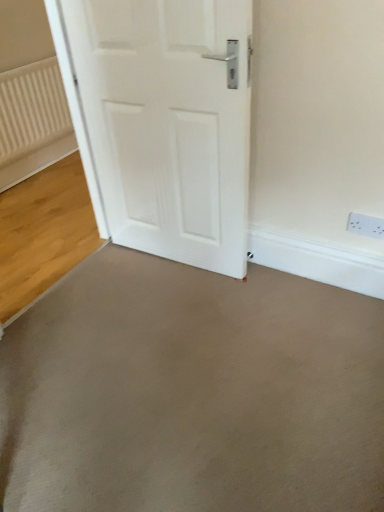
Question: Looking at their shapes, would you say white textured radiator at left is wider or thinner than white plastic electric outlet at upper right?

Choices:
 (A) thin
 (B) wide

Answer: (B)

Question: Choose the correct answer: Is white textured radiator at left inside white plastic electric outlet at upper right or outside it?

Choices:
 (A) outside
 (B) inside

Answer: (A)

Question: Which of these objects is positioned closest to the gray smooth concrete at center, which appears as the first concrete when viewed from the back?

Choices:
 (A) white textured radiator at left
 (B) smooth concrete floor at center, the 1th concrete positioned from the front
 (C) white matte door at center
 (D) white plastic electric outlet at upper right

Answer: (A)

Question: Which object is the closest to the white textured radiator at left?

Choices:
 (A) smooth concrete floor at center, arranged as the second concrete when viewed from the back
 (B) white matte door at center
 (C) gray smooth concrete at center, which appears as the first concrete when viewed from the back
 (D) white plastic electric outlet at upper right

Answer: (C)